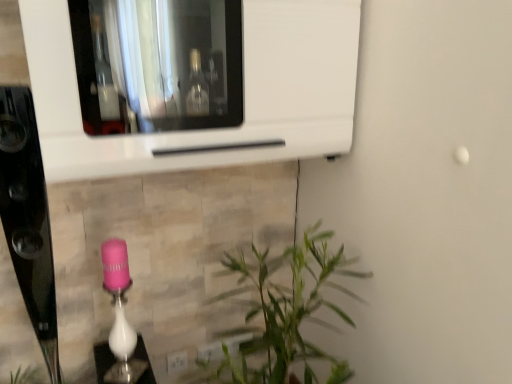
Question: Is the depth of white glossy microwave at upper center less than that of pink glossy lamp at lower center?

Choices:
 (A) yes
 (B) no

Answer: (A)

Question: Does white glossy microwave at upper center have a larger size compared to pink glossy lamp at lower center?

Choices:
 (A) no
 (B) yes

Answer: (B)

Question: Does white glossy microwave at upper center turn towards pink glossy lamp at lower center?

Choices:
 (A) no
 (B) yes

Answer: (A)

Question: Considering the relative positions of white glossy microwave at upper center and pink glossy lamp at lower center in the image provided, is white glossy microwave at upper center to the right of pink glossy lamp at lower center from the viewer's perspective?

Choices:
 (A) yes
 (B) no

Answer: (A)

Question: Is white glossy microwave at upper center behind pink glossy lamp at lower center?

Choices:
 (A) no
 (B) yes

Answer: (A)

Question: Is point [111, 249] positioned closer to the camera than point [89, 160]?

Choices:
 (A) closer
 (B) farther

Answer: (B)

Question: Is pink glossy lamp at lower center wider or thinner than white glossy microwave at upper center?

Choices:
 (A) thin
 (B) wide

Answer: (A)

Question: Relative to white glossy microwave at upper center, is pink glossy lamp at lower center in front or behind?

Choices:
 (A) behind
 (B) front

Answer: (A)

Question: From the image's perspective, is pink glossy lamp at lower center positioned above or below white glossy microwave at upper center?

Choices:
 (A) below
 (B) above

Answer: (A)

Question: Visually, is white plastic electric outlet at lower center positioned to the left or to the right of pink glossy lamp at lower center?

Choices:
 (A) right
 (B) left

Answer: (A)

Question: In terms of width, does white plastic electric outlet at lower center look wider or thinner when compared to pink glossy lamp at lower center?

Choices:
 (A) thin
 (B) wide

Answer: (A)

Question: Looking at the image, does white plastic electric outlet at lower center seem bigger or smaller compared to pink glossy lamp at lower center?

Choices:
 (A) small
 (B) big

Answer: (A)

Question: From a real-world perspective, is white plastic electric outlet at lower center positioned above or below pink glossy lamp at lower center?

Choices:
 (A) above
 (B) below

Answer: (B)

Question: Is white plastic electric outlet at lower center wider or thinner than white glossy microwave at upper center?

Choices:
 (A) thin
 (B) wide

Answer: (A)

Question: Which is correct: white plastic electric outlet at lower center is inside white glossy microwave at upper center, or outside of it?

Choices:
 (A) outside
 (B) inside

Answer: (A)